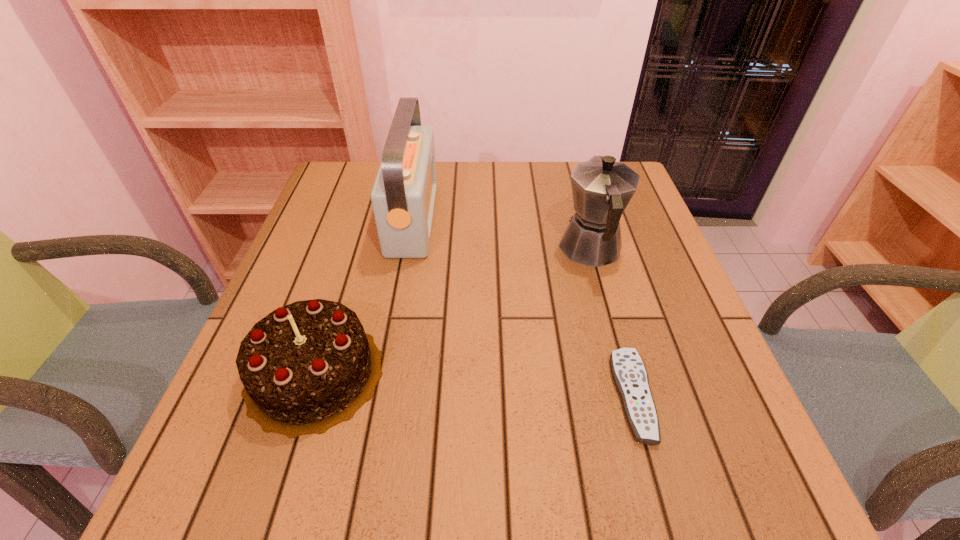
At what (x,y) coordinates should I click in order to perform the action: click on object present at the far edge. Please return your answer as a coordinate pair (x, y). Image resolution: width=960 pixels, height=540 pixels. Looking at the image, I should click on (403, 197).

The height and width of the screenshot is (540, 960). What are the coordinates of `object that is at the left edge` in the screenshot? It's located at (307, 366).

Locate an element on the screen. This screenshot has height=540, width=960. coffeepot present at the right edge is located at coordinates (601, 188).

Where is `remote control that is at the right edge`? Image resolution: width=960 pixels, height=540 pixels. remote control that is at the right edge is located at coordinates (629, 373).

Locate an element on the screen. This screenshot has width=960, height=540. free space at the far edge of the desktop is located at coordinates (460, 192).

In order to click on vacant space at the near edge in this screenshot , I will do `click(322, 511)`.

Where is `vacant region at the left edge of the desktop`? vacant region at the left edge of the desktop is located at coordinates (335, 302).

In the image, there is a desktop. Where is `blank space at the right edge`? The height and width of the screenshot is (540, 960). blank space at the right edge is located at coordinates (626, 267).

This screenshot has width=960, height=540. Identify the location of vacant space at the near right corner of the desktop. (683, 484).

Find the location of `free spot between the third tallest object and the coffeepot`. free spot between the third tallest object and the coffeepot is located at coordinates (453, 312).